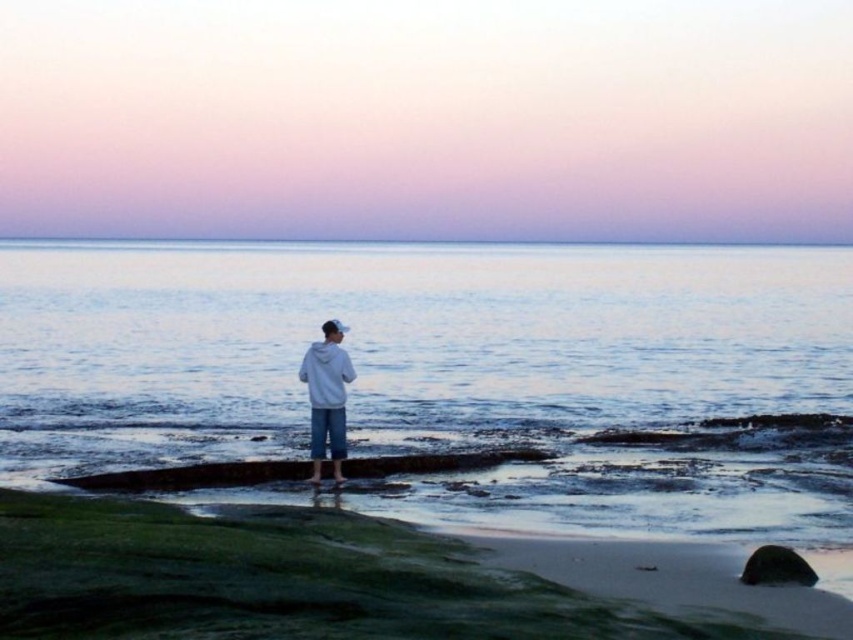
The width and height of the screenshot is (853, 640). Describe the element at coordinates (450, 371) in the screenshot. I see `blue water at center` at that location.

Which is behind, point (242, 291) or point (796, 579)?

Positioned behind is point (242, 291).

Is point (347, 340) farther from camera compared to point (756, 572)?

That is True.

Locate an element on the screen. blue water at center is located at coordinates (450, 371).

Based on the photo, does white matte hoodie at center appear over smooth gray rock at lower right?

Correct, white matte hoodie at center is located above smooth gray rock at lower right.

The width and height of the screenshot is (853, 640). What do you see at coordinates (328, 397) in the screenshot?
I see `white matte hoodie at center` at bounding box center [328, 397].

Is point (311, 385) positioned behind point (779, 570)?

Yes, it is behind point (779, 570).

Where is `white matte hoodie at center`? white matte hoodie at center is located at coordinates (328, 397).

Is blue water at center shorter than white matte hoodie at center?

No, blue water at center is not shorter than white matte hoodie at center.

Is point (451, 401) closer to camera compared to point (326, 420)?

No.

Does point (102, 470) come closer to viewer compared to point (300, 365)?

No, (102, 470) is behind (300, 365).

At what (x,y) coordinates should I click in order to perform the action: click on blue water at center. Please return your answer as a coordinate pair (x, y). Image resolution: width=853 pixels, height=640 pixels. Looking at the image, I should click on (450, 371).